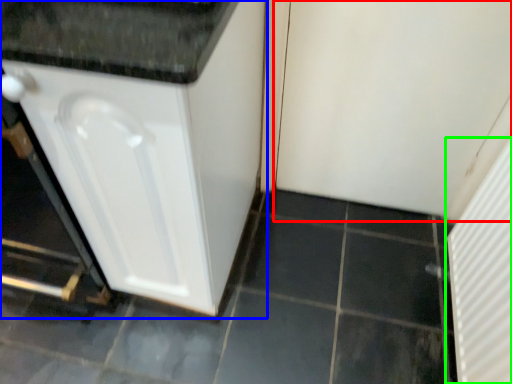
Question: Based on their relative distances, which object is nearer to screen door (highlighted by a red box)? Choose from cabinetry (highlighted by a blue box) and screen door (highlighted by a green box).

Choices:
 (A) cabinetry
 (B) screen door

Answer: (B)